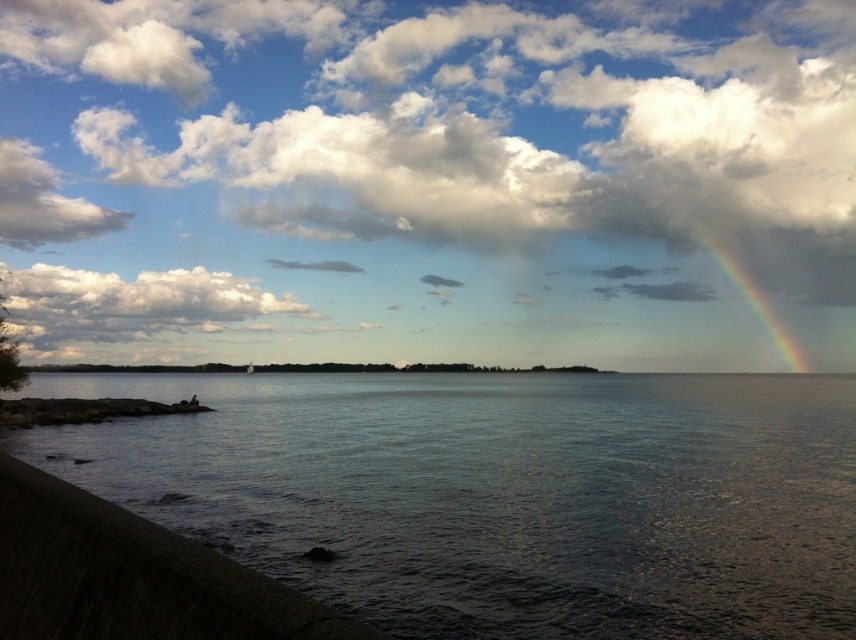
You are standing at the lakeside and want to walk towards the dark gray water at lower left. However, there is a dark concrete wall at lower left in your path. Can you reach the water without climbing over the wall?

The dark gray water at lower left is further to the viewer than the dark concrete wall at lower left, meaning the wall is closer to you. Therefore, you cannot reach the water without going around or over the wall since the wall is blocking the path directly to the water.

You are standing on the embankment and want to know which object is higher between the dark gray water at lower left and the dark concrete wall at lower left. Can you determine this based on the scene?

The dark gray water at lower left is taller than the dark concrete wall at lower left, so the water is higher than the wall.